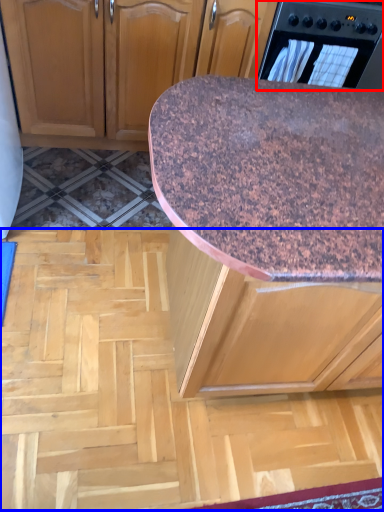
Question: Which point is closer to the camera, home appliance (highlighted by a red box) or plywood (highlighted by a blue box)?

Choices:
 (A) home appliance
 (B) plywood

Answer: (B)